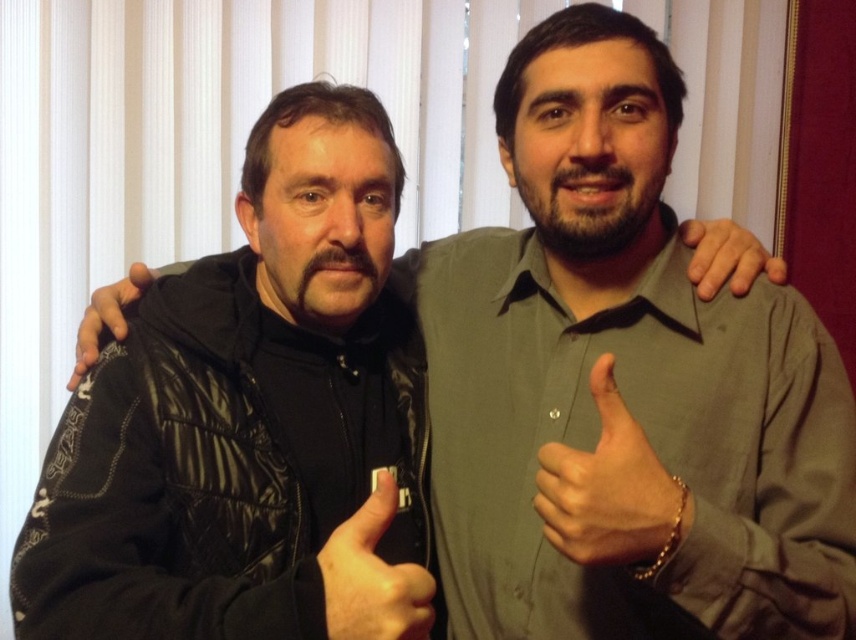
Looking at this image, is the position of black quilted jacket at left more distant than that of leather jacket at left?

No, it is not.

Between black quilted jacket at left and leather jacket at left, which one appears on the right side from the viewer's perspective?

Positioned to the right is black quilted jacket at left.

Who is more distant from viewer, (181, 461) or (140, 291)?

Point (140, 291)

Find the location of `black quilted jacket at left`. black quilted jacket at left is located at coordinates (251, 420).

Can you confirm if matte gray shirt at center is smaller than leather jacket at left?

Indeed, matte gray shirt at center has a smaller size compared to leather jacket at left.

Is point (562, 472) positioned behind point (110, 285)?

No, it is in front of (110, 285).

The width and height of the screenshot is (856, 640). I want to click on matte gray shirt at center, so click(x=608, y=488).

Is black quilted jacket at left positioned behind matte gray shirt at center?

No.

Looking at this image, does black quilted jacket at left have a lesser height compared to matte gray shirt at center?

In fact, black quilted jacket at left may be taller than matte gray shirt at center.

Image resolution: width=856 pixels, height=640 pixels. In order to click on black quilted jacket at left in this screenshot , I will do `click(251, 420)`.